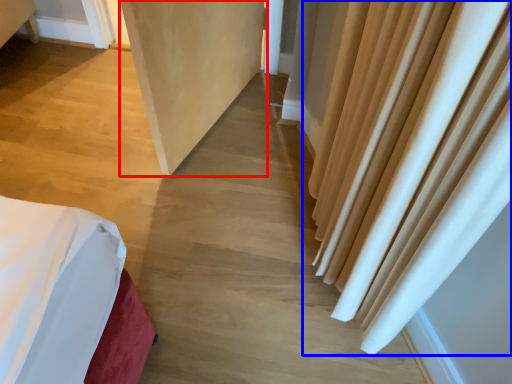
Question: Which object appears farthest to the camera in this image, screen door (highlighted by a red box) or curtain (highlighted by a blue box)?

Choices:
 (A) screen door
 (B) curtain

Answer: (B)